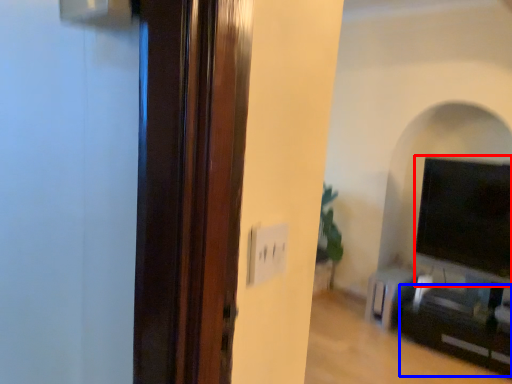
Question: Which of the following is the farthest to the observer, wide (highlighted by a red box) or entertainment center (highlighted by a blue box)?

Choices:
 (A) wide
 (B) entertainment center

Answer: (A)